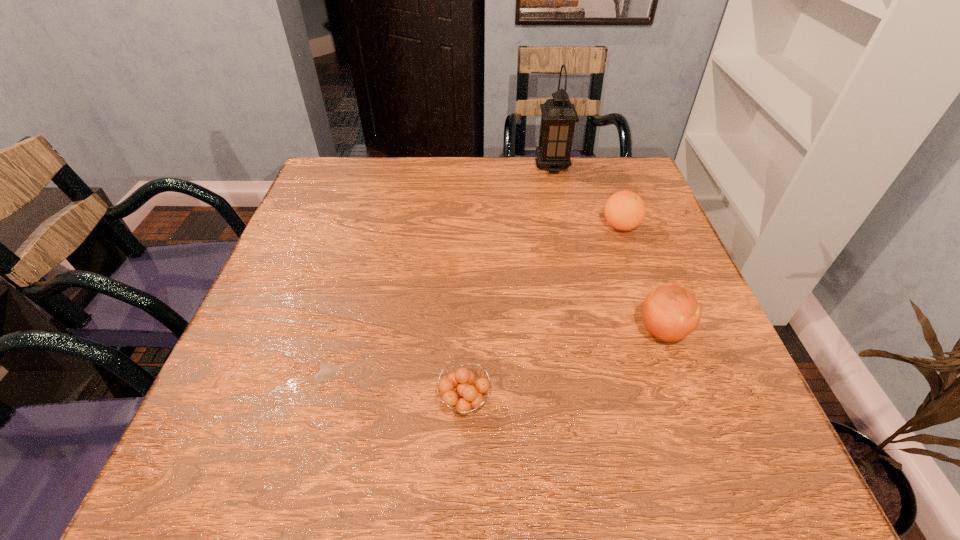
Identify the location of object that stands as the second closest to the shortest orange fruit. The width and height of the screenshot is (960, 540). (625, 210).

Locate an element on the screen. The image size is (960, 540). object that is the second closest one to the nearest orange fruit is located at coordinates (625, 210).

Find the location of a particular element. This screenshot has width=960, height=540. orange fruit identified as the second closest to the tallest orange fruit is located at coordinates (458, 388).

Image resolution: width=960 pixels, height=540 pixels. Find the location of `orange fruit that is the closest to the tallest orange fruit`. orange fruit that is the closest to the tallest orange fruit is located at coordinates (625, 210).

The image size is (960, 540). I want to click on vacant space that satisfies the following two spatial constraints: 1. on the back side of the second farthest object; 2. on the left side of the leftmost orange fruit, so click(469, 226).

You are a GUI agent. You are given a task and a screenshot of the screen. Output one action in this format:
    pyautogui.click(x=<x>, y=<y>)
    Task: Click on the free space that satisfies the following two spatial constraints: 1. on the back side of the second tallest object; 2. on the right side of the leftmost object
    
    Given the screenshot: What is the action you would take?
    pyautogui.click(x=467, y=331)